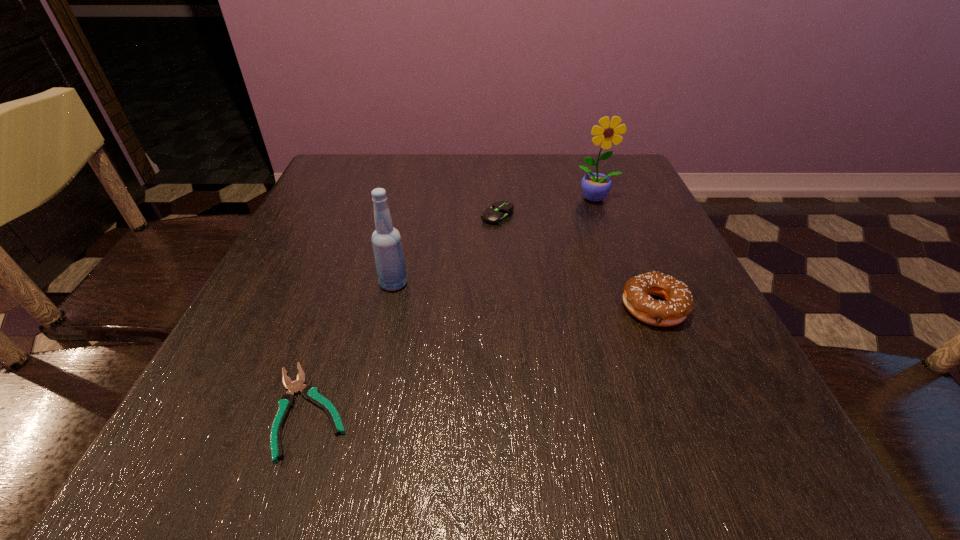
This screenshot has width=960, height=540. What are the coordinates of `sunflower` in the screenshot? It's located at (595, 186).

The image size is (960, 540). I want to click on bottle, so click(387, 246).

The image size is (960, 540). I want to click on doughnut, so click(678, 304).

I want to click on computer mouse, so click(500, 212).

Locate an element on the screen. the third object from right to left is located at coordinates (500, 212).

The image size is (960, 540). Find the location of `the shortest object`. the shortest object is located at coordinates (310, 393).

Image resolution: width=960 pixels, height=540 pixels. I want to click on pliers, so click(x=310, y=393).

I want to click on vacant region located on the front-facing side of the sunflower, so click(604, 218).

Find the location of a particular element. free space located on the right of the bottle is located at coordinates (619, 284).

This screenshot has height=540, width=960. I want to click on vacant space located on the back of the doughnut, so click(612, 207).